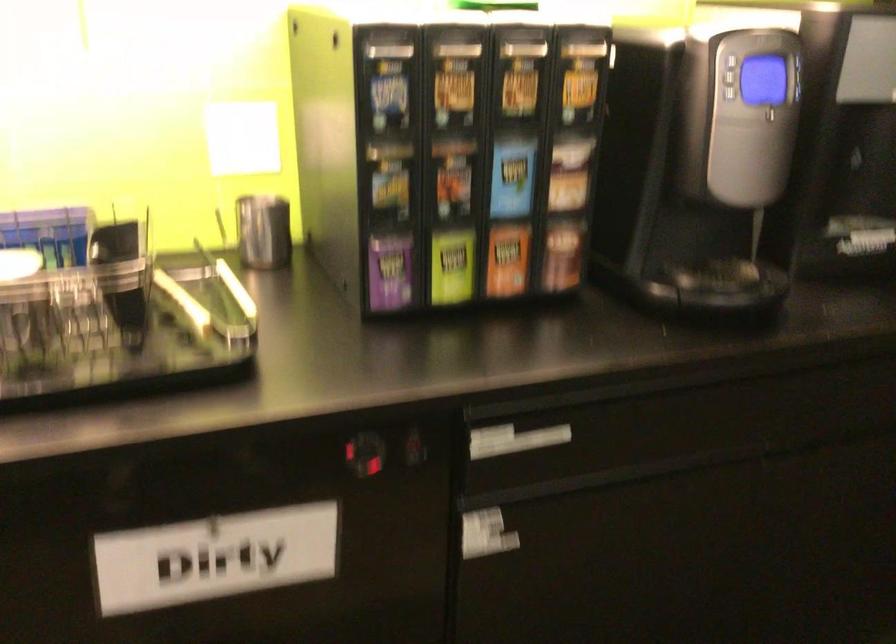
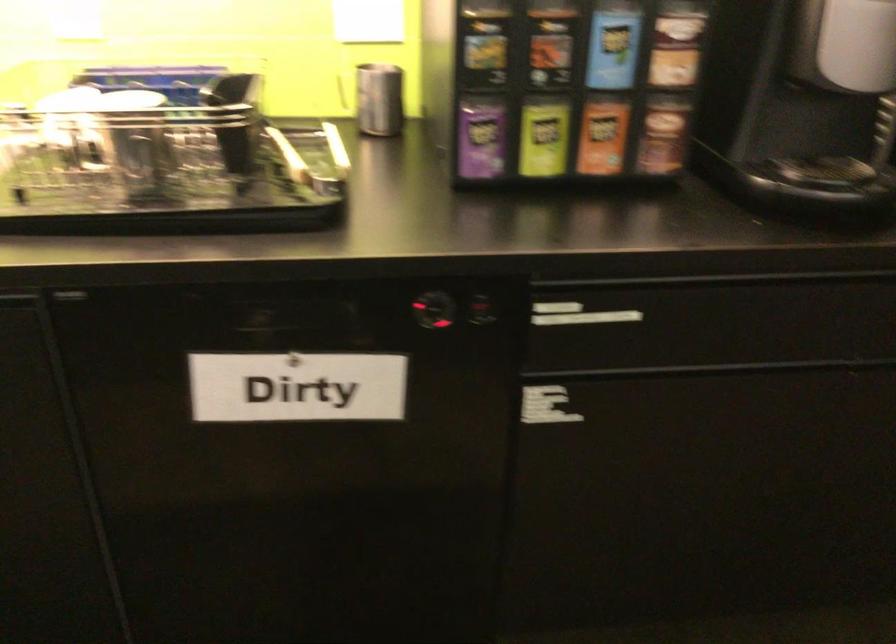
In the second image, find the point that corresponds to [513,444] in the first image.

(578, 315)